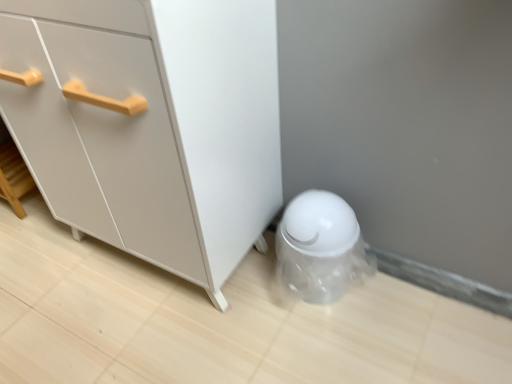
Question: Does transparent plastic trash can at lower right come behind white matte cabinet at center?

Choices:
 (A) no
 (B) yes

Answer: (B)

Question: Is transparent plastic trash can at lower right directly adjacent to white matte cabinet at center?

Choices:
 (A) no
 (B) yes

Answer: (A)

Question: Is transparent plastic trash can at lower right at the right side of white matte cabinet at center?

Choices:
 (A) yes
 (B) no

Answer: (A)

Question: Does transparent plastic trash can at lower right have a greater height compared to white matte cabinet at center?

Choices:
 (A) yes
 (B) no

Answer: (B)

Question: Considering the relative sizes of transparent plastic trash can at lower right and white matte cabinet at center in the image provided, is transparent plastic trash can at lower right wider than white matte cabinet at center?

Choices:
 (A) yes
 (B) no

Answer: (B)

Question: Would you say transparent plastic trash can at lower right is outside white matte cabinet at center?

Choices:
 (A) yes
 (B) no

Answer: (A)

Question: Can you confirm if white matte cabinet at center is bigger than transparent plastic trash can at lower right?

Choices:
 (A) yes
 (B) no

Answer: (A)

Question: From a real-world perspective, is white matte cabinet at center physically above transparent plastic trash can at lower right?

Choices:
 (A) yes
 (B) no

Answer: (A)

Question: Is the position of white matte cabinet at center more distant than that of transparent plastic trash can at lower right?

Choices:
 (A) no
 (B) yes

Answer: (A)

Question: Is white matte cabinet at center far from transparent plastic trash can at lower right?

Choices:
 (A) yes
 (B) no

Answer: (B)

Question: Can you confirm if white matte cabinet at center is smaller than transparent plastic trash can at lower right?

Choices:
 (A) no
 (B) yes

Answer: (A)

Question: Is white matte cabinet at center at the right side of transparent plastic trash can at lower right?

Choices:
 (A) yes
 (B) no

Answer: (B)

Question: Considering their positions, is transparent plastic trash can at lower right located in front of or behind white matte cabinet at center?

Choices:
 (A) behind
 (B) front

Answer: (A)